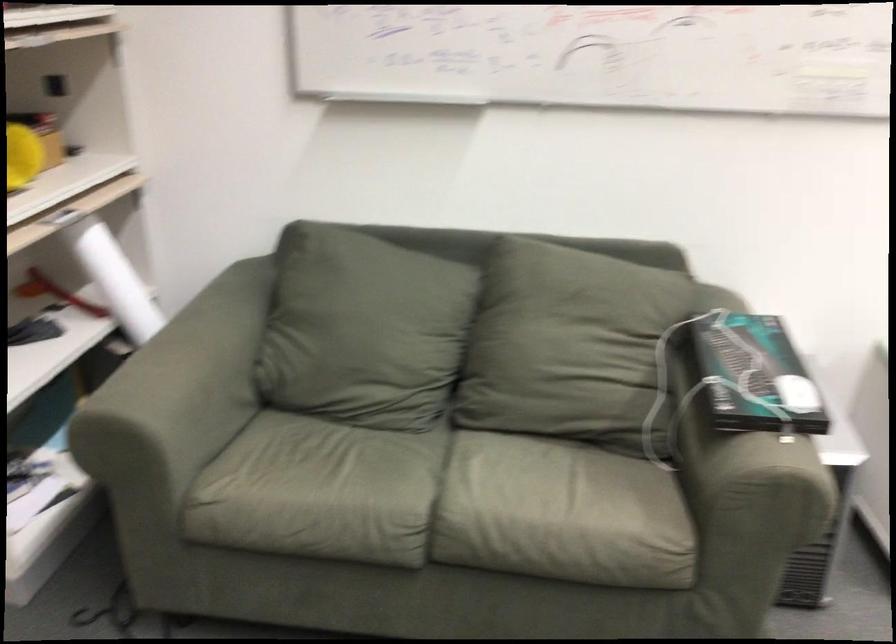
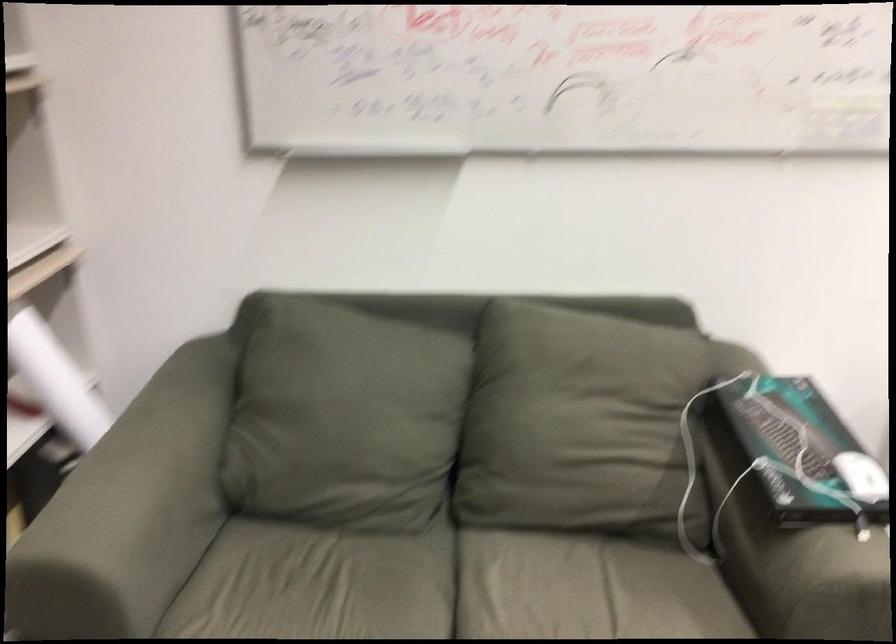
In a continuous first-person perspective shot, in which direction is the camera moving?

The movement direction of the cameraman is left, forward.